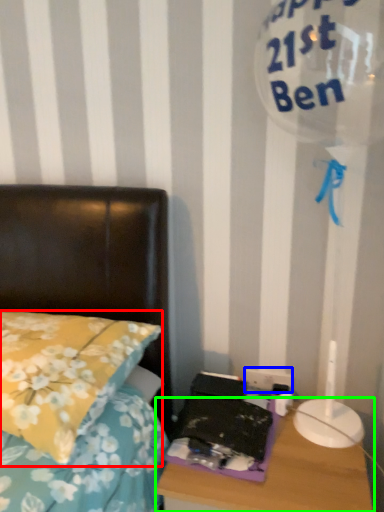
Question: Which object is positioned closest to pillow (highlighted by a red box)? Select from electric outlet (highlighted by a blue box) and nightstand (highlighted by a green box).

Choices:
 (A) electric outlet
 (B) nightstand

Answer: (B)